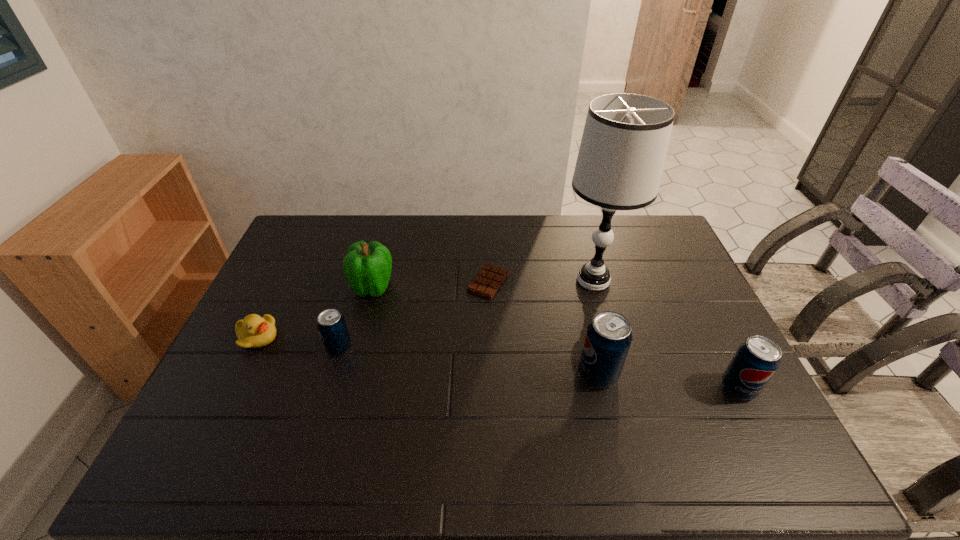
If the aim is uniform spacing by inserting an additional pop_(soda) among them, please point to a vacant space for this new pop_(soda). Please provide its 2D coordinates. Your answer should be formatted as a tuple, i.e. [(x, y)], where the tuple contains the x and y coordinates of a point satisfying the conditions above.

[(466, 361)]